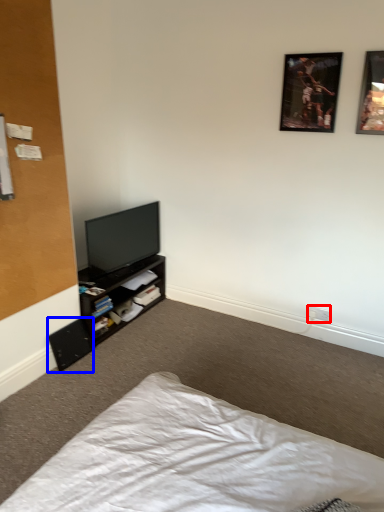
Question: Among these objects, which one is nearest to the camera, electric outlet (highlighted by a red box) or speaker (highlighted by a blue box)?

Choices:
 (A) electric outlet
 (B) speaker

Answer: (B)